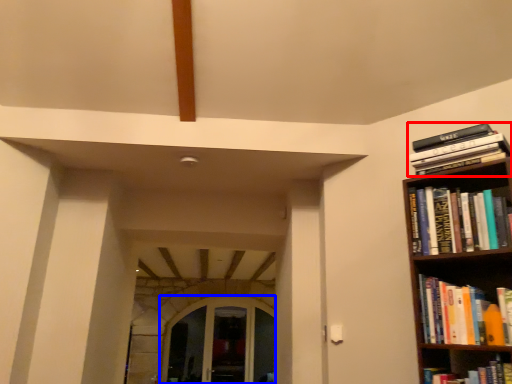
Question: Which object appears closest to the camera in this image, book (highlighted by a red box) or glass door (highlighted by a blue box)?

Choices:
 (A) book
 (B) glass door

Answer: (A)